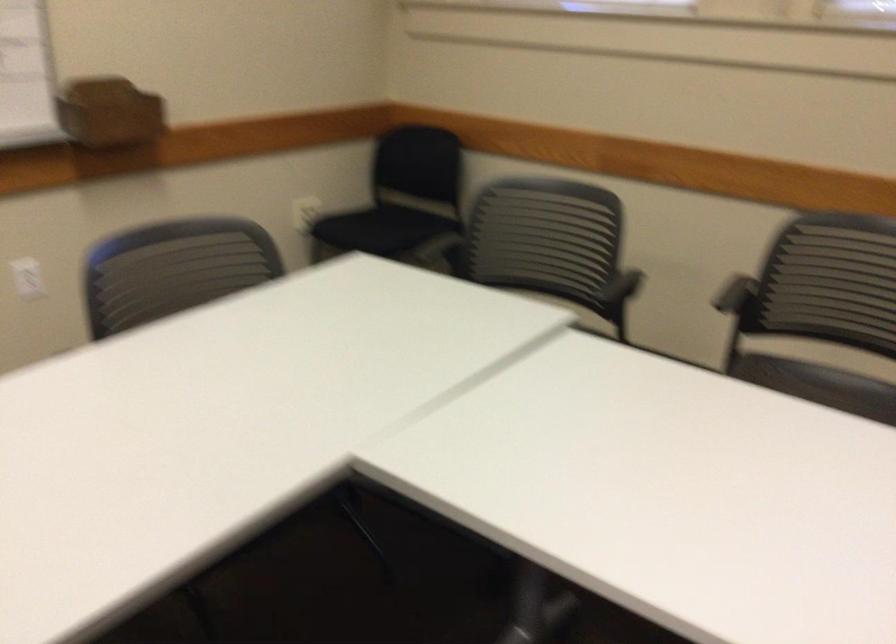
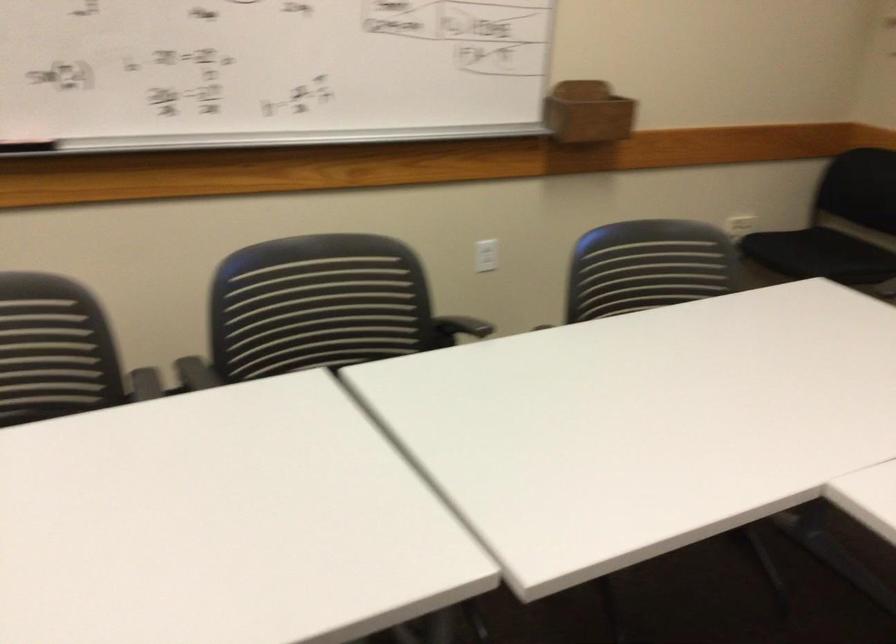
The point at (x=108, y=114) is marked in the first image. Where is the corresponding point in the second image?

(588, 111)